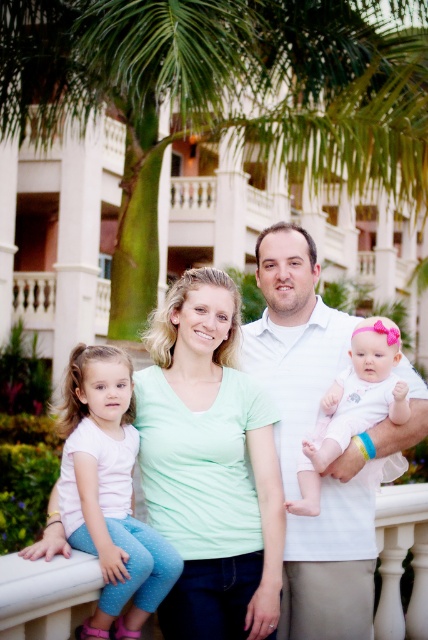
Who is positioned more to the right, white cotton shirt at center or white soft fabric baby at center?

white soft fabric baby at center is more to the right.

Is point (296, 492) farther from camera compared to point (342, 381)?

No, it is not.

What do you see at coordinates (342, 538) in the screenshot?
I see `white cotton shirt at center` at bounding box center [342, 538].

This screenshot has width=428, height=640. What are the coordinates of `white cotton shirt at center` in the screenshot? It's located at (342, 538).

Is pink fabric baby at center behind pink fabric shirt at left?

No, pink fabric baby at center is closer to the viewer.

Between pink fabric baby at center and pink fabric shirt at left, which one appears on the left side from the viewer's perspective?

pink fabric shirt at left is more to the left.

Is point (403, 426) positioned before point (77, 385)?

No.

At what (x,y) coordinates should I click in order to perform the action: click on pink fabric baby at center. Please return your answer as a coordinate pair (x, y). Image resolution: width=428 pixels, height=640 pixels. Looking at the image, I should click on (342, 538).

From the picture: Can you confirm if pink fabric baby at center is taller than white soft fabric baby at center?

Yes, pink fabric baby at center is taller than white soft fabric baby at center.

Which of these two, pink fabric baby at center or white soft fabric baby at center, stands taller?

With more height is pink fabric baby at center.

Between point (272, 262) and point (291, 500), which one is positioned behind?

Point (272, 262)

Find the location of a particular element. The height and width of the screenshot is (640, 428). pink fabric baby at center is located at coordinates (342, 538).